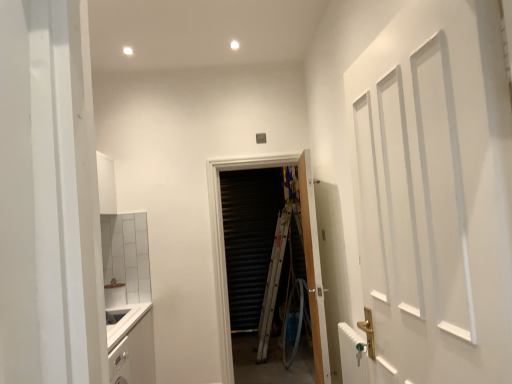
Question: Is white matte cabinet at lower left taller or shorter than wooden door at center, acting as the second door starting from the back?

Choices:
 (A) tall
 (B) short

Answer: (B)

Question: Is white matte cabinet at lower left situated inside wooden door at center, acting as the second door starting from the back, or outside?

Choices:
 (A) outside
 (B) inside

Answer: (A)

Question: Based on their relative distances, which object is farther from the white metallic radiator at lower right?

Choices:
 (A) white matte door at right, the 1th door from the front
 (B) wooden door at center, the third door in the front-to-back sequence
 (C) white matte cabinet at lower left
 (D) wooden door at center, acting as the second door starting from the back

Answer: (C)

Question: Considering the real-world distances, which object is closest to the wooden door at center, the second door viewed from the front?

Choices:
 (A) wooden door at center, marked as the first door in a back-to-front arrangement
 (B) white matte door at right, the 1th door from the front
 (C) white matte cabinet at lower left
 (D) white metallic radiator at lower right

Answer: (A)